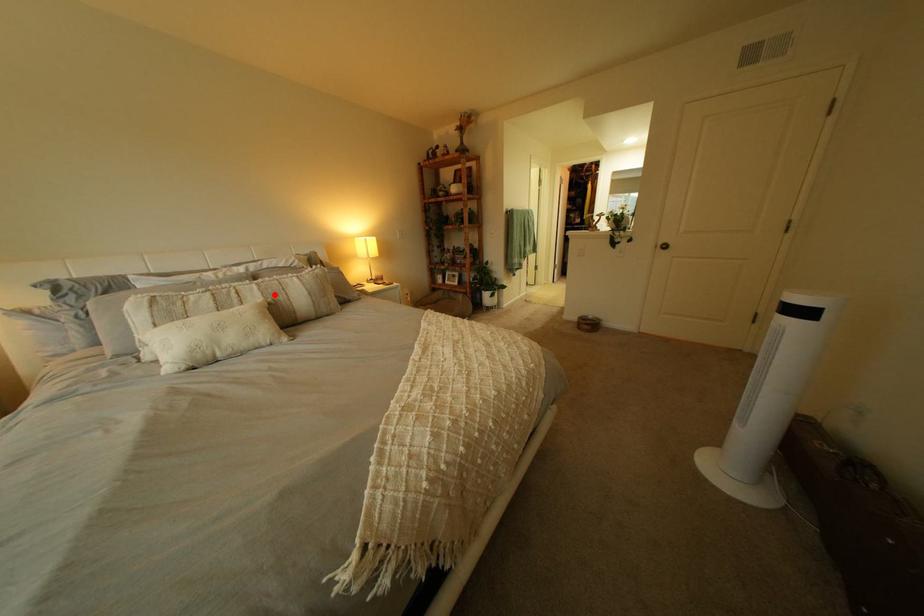
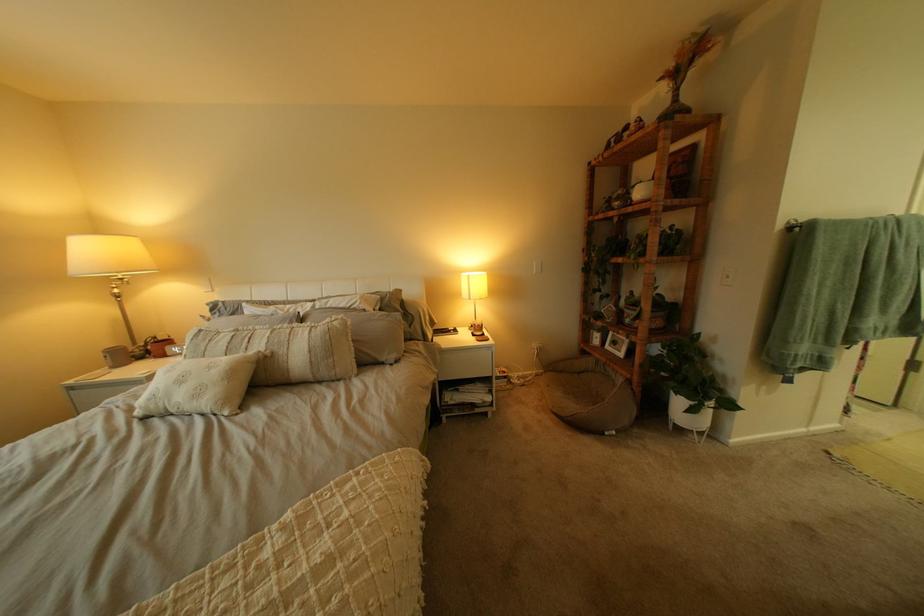
Question: I am providing you with two images of the same scene from different viewpoints. Given a red point in image1, look at the same physical point in image2. Is it:

Choices:
 (A) Closer to the viewpoint
 (B) Farther from the viewpoint

Answer: (B)